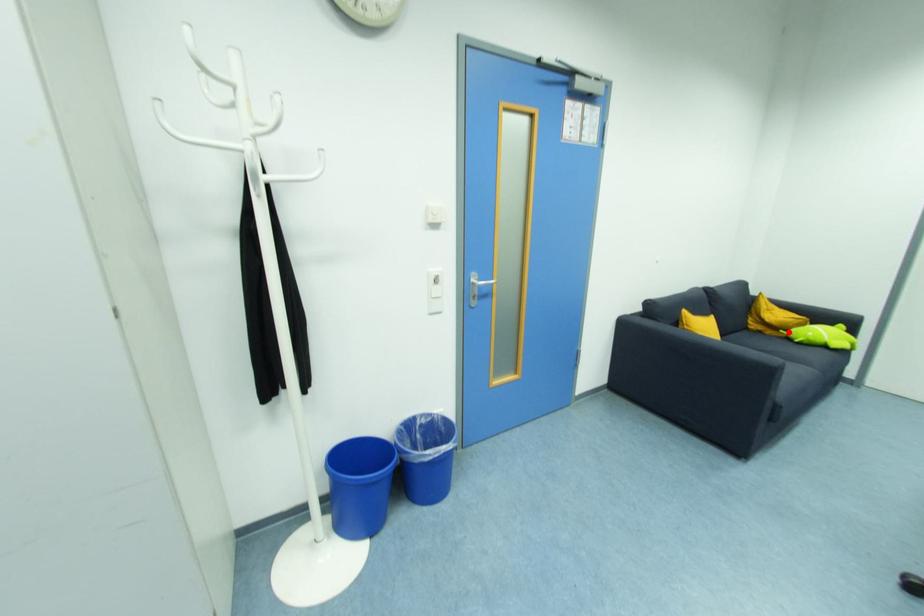
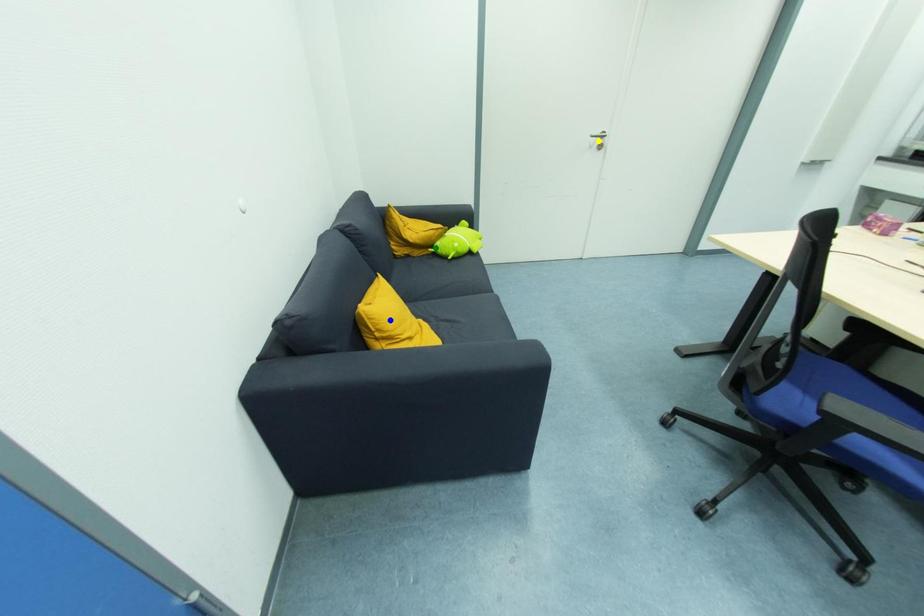
Question: I am providing you with two images of the same scene from different viewpoints. A red point is marked on the first image. You are given multiple points on the second image. Can you choose the point in image 2 that corresponds to the point in image 1?

Choices:
 (A) green point
 (B) yellow point
 (C) blue point

Answer: (A)